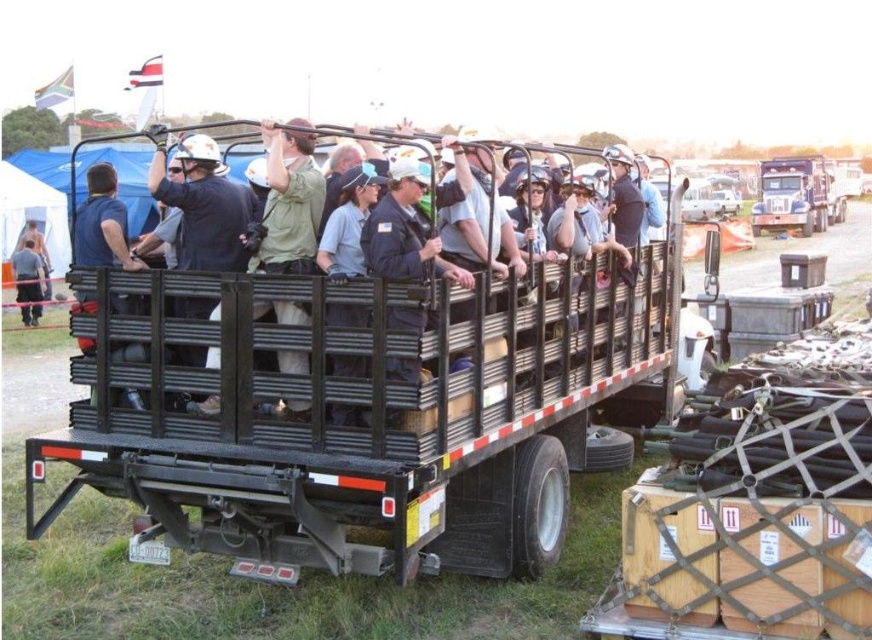
Question: In this image, where is black metal trailer truck at center located relative to metallic silver truck at upper right?

Choices:
 (A) above
 (B) below

Answer: (B)

Question: Which point appears closest to the camera in this image?

Choices:
 (A) (584, 298)
 (B) (31, 305)
 (C) (782, 198)

Answer: (A)

Question: Which object is the farthest from the metallic silver truck at upper right?

Choices:
 (A) black metal trailer truck at center
 (B) dark gray uniform at lower left

Answer: (A)

Question: Can you confirm if black metal trailer truck at center is positioned to the right of metallic silver truck at upper right?

Choices:
 (A) yes
 (B) no

Answer: (B)

Question: Based on their relative distances, which object is nearer to the black metal trailer truck at center?

Choices:
 (A) metallic silver truck at upper right
 (B) dark gray uniform at lower left

Answer: (B)

Question: Is metallic silver truck at upper right behind dark gray uniform at lower left?

Choices:
 (A) yes
 (B) no

Answer: (A)